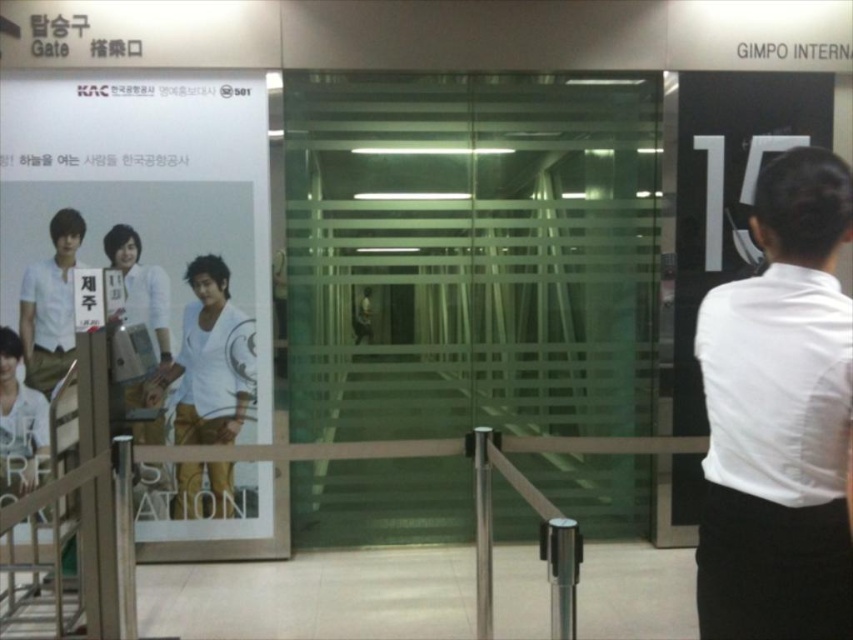
Does white glossy poster at left have a smaller size compared to white matte shirt at center?

No.

Between white glossy poster at left and white matte shirt at center, which one is positioned lower?

white matte shirt at center is lower down.

Is point (216, 228) less distant than point (190, 324)?

Yes, point (216, 228) is in front of point (190, 324).

What are the coordinates of `white glossy poster at left` in the screenshot? It's located at (141, 180).

Does white smooth shirt at right have a smaller size compared to white glossy poster at left?

Yes, white smooth shirt at right is smaller than white glossy poster at left.

Is white smooth shirt at right to the left of white glossy poster at left from the viewer's perspective?

No, white smooth shirt at right is not to the left of white glossy poster at left.

Which is behind, point (759, 182) or point (91, 228)?

Positioned behind is point (759, 182).

Image resolution: width=853 pixels, height=640 pixels. In order to click on white smooth shirt at right in this screenshot , I will do `click(779, 419)`.

Who is positioned more to the right, white smooth shirt at right or white matte shirt at center?

white smooth shirt at right is more to the right.

Which is behind, point (735, 420) or point (247, 378)?

The point (247, 378) is behind.

The width and height of the screenshot is (853, 640). Find the location of `white smooth shirt at right`. white smooth shirt at right is located at coordinates (779, 419).